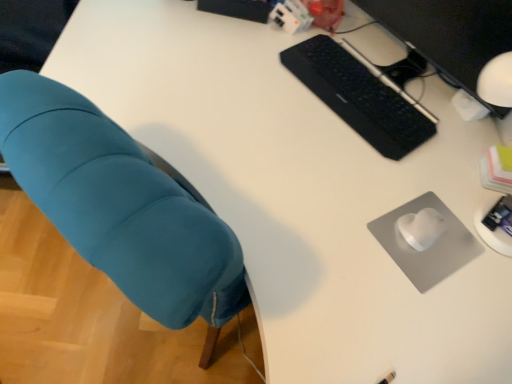
At what (x,y) coordinates should I click in order to perform the action: click on vacant space in front of black matte computer monitor at upper right. Please return your answer as a coordinate pair (x, y). This screenshot has height=384, width=512. Looking at the image, I should click on pos(360,157).